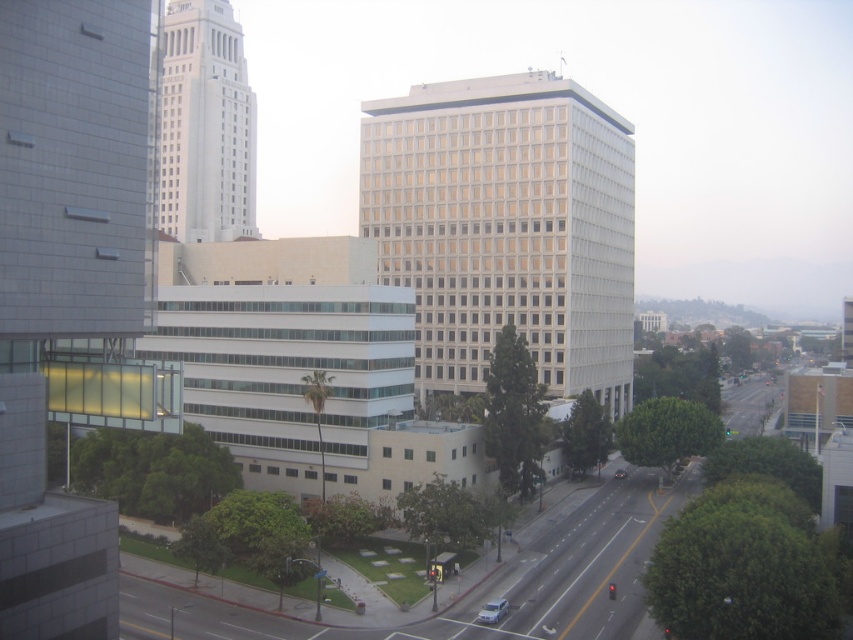
You are a delivery person who needs to park your truck next to the white matte car at lower center and the shiny black sedan at center. Since your truck is 2 meters tall, can you park it there without hitting the overhead structure?

The white matte car at lower center has a lesser height compared to shiny black sedan at center. Since the truck is 2 meters tall, and the white matte car at lower center is shorter than the shiny black sedan at center, but the exact height of the white matte car at lower center is not provided. Therefore, it is uncertain if the truck can park there without hitting the overhead structure.

You are a delivery driver who needs to park your vehicle in this area. You see a white matte car at lower center and a shiny black sedan at center. Which vehicle takes up less space in the parking spot?

The white matte car at lower center takes up less space in the parking spot because it has a smaller size compared to the shiny black sedan at center.

Based on the photo, you are a delivery driver who needs to park your truck between the white matte car at lower center and the shiny black sedan at center. Your truck requires a minimum of 60 meters of space. Is there enough space between them?

The distance between the white matte car at lower center and the shiny black sedan at center is 58.31 meters. Since your truck requires a minimum of 60 meters, there is not enough space between them to park.